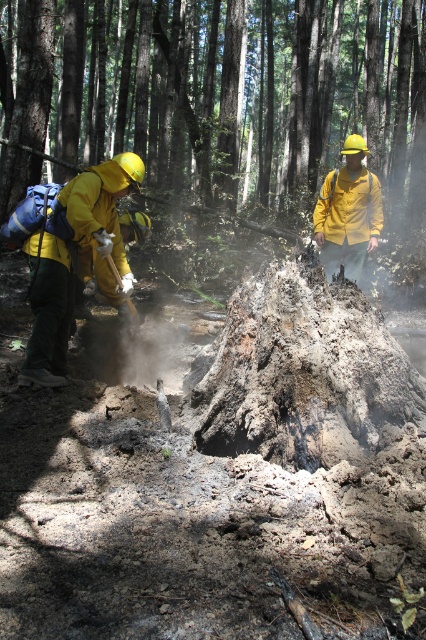
Looking at this image, you are a park ranger assessing the forest area. You notice the charcoal ash stump at center and the matte yellow helmet at center. Which object occupies more space in the scene?

The charcoal ash stump at center is bigger than the matte yellow helmet at center, so it occupies more space in the scene.

You are navigating through a forest and see two points marked on a map. The first point is at coordinates point (2, 132) and the second point is at point (348, 163). Which point is closer to your current position if you are standing behind both points?

Point (2, 132) is behind point (348, 163), so if you are standing behind both points, point (2, 132) is closer to your current position.

You are a safety inspector in the forest and need to check the distance between the matte yellow jacket at left and the camera. The safety regulation requires that the distance between safety equipment and monitoring devices must be at least 4 meters. Is the current distance compliant with the regulation?

The matte yellow jacket at left and the camera are 3.87 meters apart from each other, which is less than the required 4 meters. Therefore, the current distance does not comply with the safety regulation.